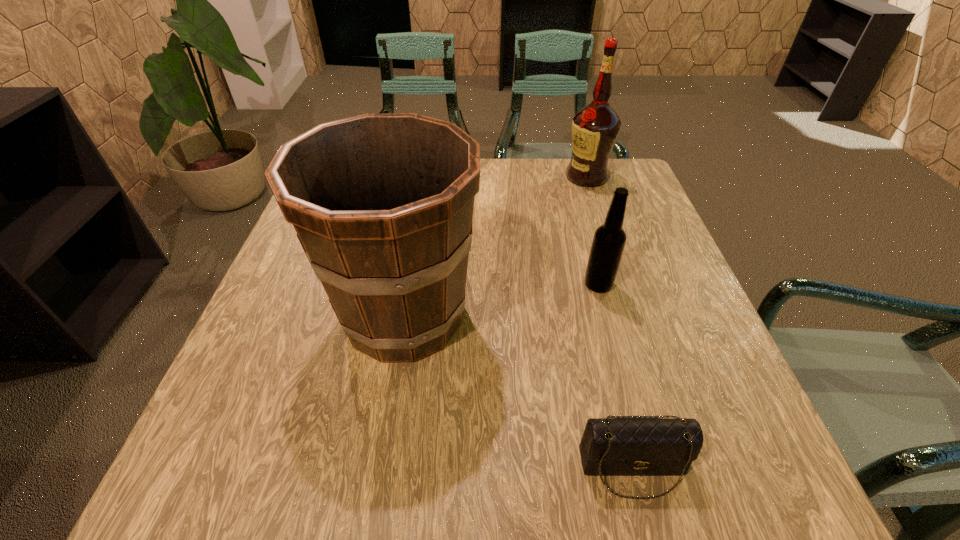
Where is `vacant area at the left edge`? vacant area at the left edge is located at coordinates (257, 341).

In the image, there is a desktop. In order to click on vacant space at the right edge in this screenshot , I will do `click(631, 340)`.

The image size is (960, 540). Identify the location of vacant region at the near right corner of the desktop. tap(775, 490).

In order to click on free space between the beer bottle and the bucket in this screenshot , I will do `click(501, 300)`.

Locate an element on the screen. free spot between the beer bottle and the alcohol is located at coordinates (592, 231).

The width and height of the screenshot is (960, 540). Identify the location of free space between the alcohol and the beer bottle. (592, 231).

Locate an element on the screen. This screenshot has height=540, width=960. free space between the bucket and the alcohol is located at coordinates (495, 246).

The image size is (960, 540). In order to click on empty space between the alcohol and the second shortest object in this screenshot , I will do `click(592, 231)`.

The height and width of the screenshot is (540, 960). I want to click on free point between the shortest object and the farthest object, so click(610, 322).

This screenshot has height=540, width=960. Identify the location of empty location between the beer bottle and the clutch bag. (615, 376).